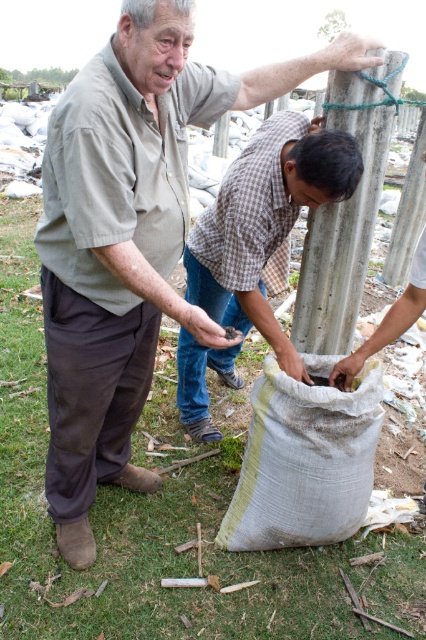
Based on the photo, which of these two, beige canvas sack at lower center or concrete pole at center, stands shorter?

With less height is beige canvas sack at lower center.

Does beige canvas sack at lower center appear on the right side of concrete pole at center?

Incorrect, beige canvas sack at lower center is not on the right side of concrete pole at center.

Is point (285, 481) more distant than point (337, 204)?

That is False.

Image resolution: width=426 pixels, height=640 pixels. I want to click on beige canvas sack at lower center, so click(304, 464).

Between matte gray shirt at center and checkered fabric shirt at center, which one appears on the left side from the viewer's perspective?

matte gray shirt at center

Can you confirm if matte gray shirt at center is positioned above checkered fabric shirt at center?

Indeed, matte gray shirt at center is positioned over checkered fabric shirt at center.

Is point (115, 92) positioned after point (218, 244)?

That is False.

The width and height of the screenshot is (426, 640). Find the location of `matte gray shirt at center`. matte gray shirt at center is located at coordinates click(129, 237).

Does matte gray shirt at center appear on the left side of beige canvas sack at lower center?

Indeed, matte gray shirt at center is positioned on the left side of beige canvas sack at lower center.

Is matte gray shirt at center further to the viewer compared to beige canvas sack at lower center?

No.

Does point (129, 116) lie behind point (331, 486)?

That is False.

Locate an element on the screen. This screenshot has height=640, width=426. matte gray shirt at center is located at coordinates (129, 237).